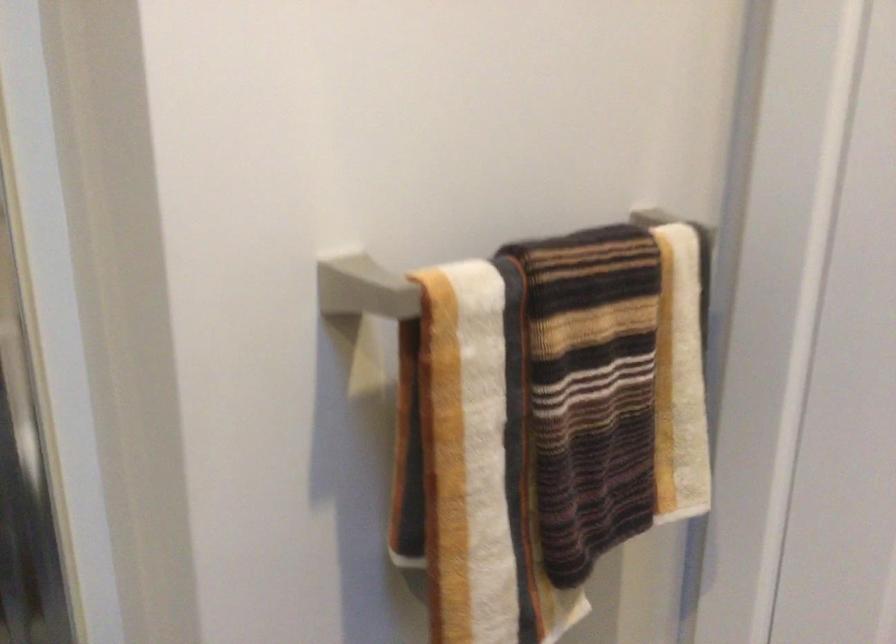
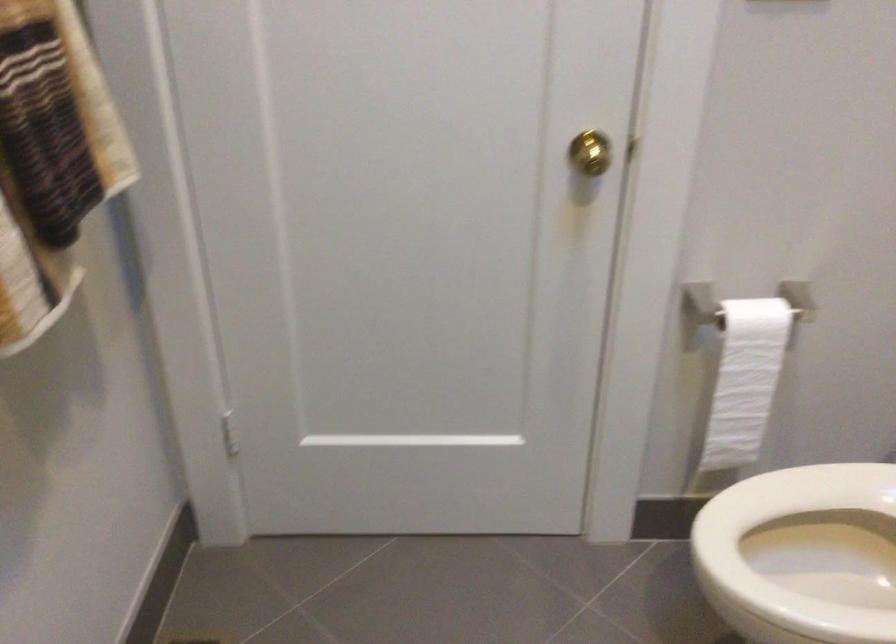
Based on the continuous images, in which direction is the camera rotating?

The camera rotated toward right-down.